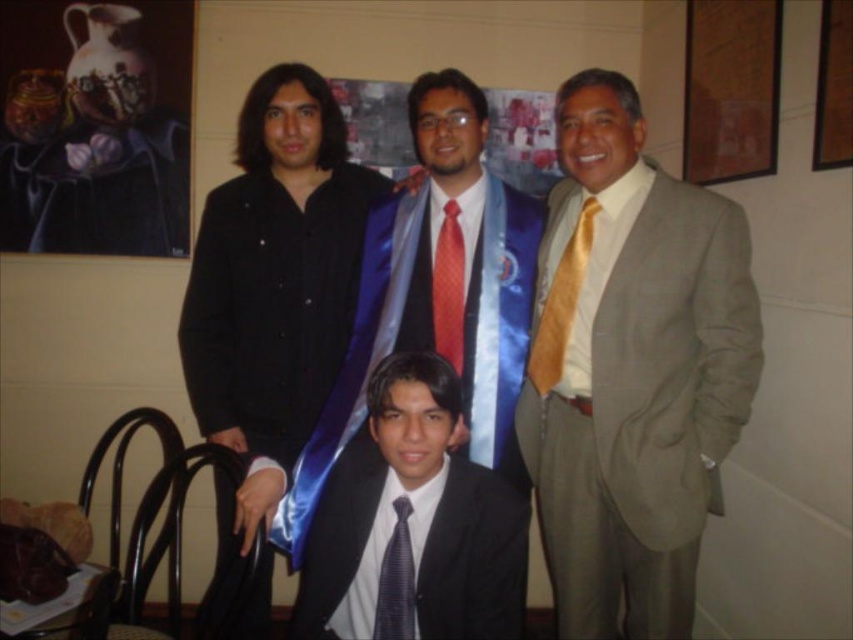
Question: Can you confirm if black satin suit at lower center is wider than red satin tie at center?

Choices:
 (A) yes
 (B) no

Answer: (A)

Question: Which object is farther from the camera taking this photo?

Choices:
 (A) matte gold tie at right
 (B) matte gray suit at right
 (C) red satin tie at center

Answer: (C)

Question: Considering the real-world distances, which object is closest to the matte gold tie at right?

Choices:
 (A) dark blue textured tie at center
 (B) black satin suit at lower center

Answer: (B)

Question: Which of the following is the farthest from the observer?

Choices:
 (A) pyautogui.click(x=451, y=497)
 (B) pyautogui.click(x=477, y=218)
 (C) pyautogui.click(x=323, y=340)

Answer: (C)

Question: Does black satin jacket at upper left have a larger size compared to matte gold tie at right?

Choices:
 (A) yes
 (B) no

Answer: (A)

Question: Can you confirm if shiny blue sash at center is positioned below black satin suit at lower center?

Choices:
 (A) no
 (B) yes

Answer: (A)